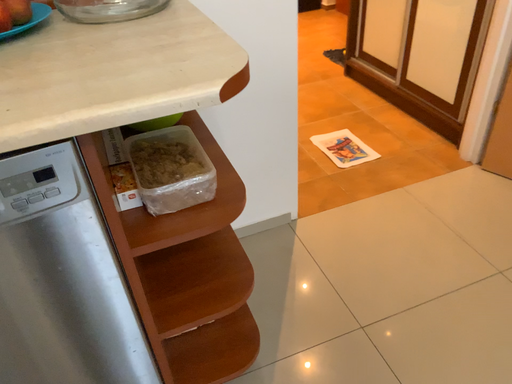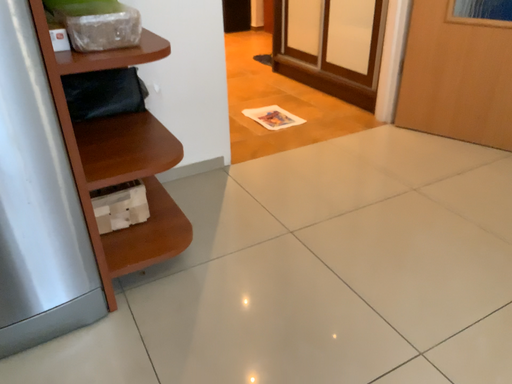
Question: Which way did the camera rotate in the video?

Choices:
 (A) rotated left
 (B) rotated right

Answer: (B)